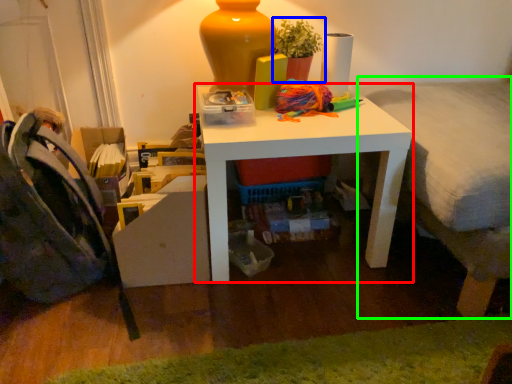
Question: Which is nearer to the table (highlighted by a red box)? houseplant (highlighted by a blue box) or bed (highlighted by a green box).

Choices:
 (A) houseplant
 (B) bed

Answer: (B)